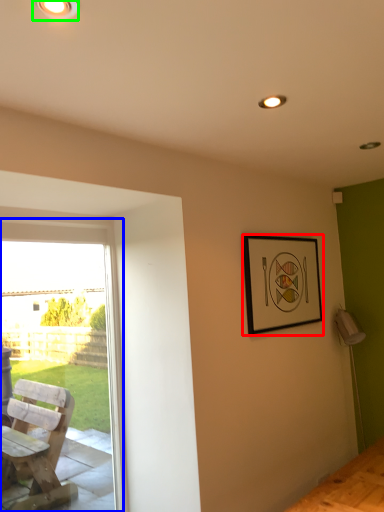
Question: Considering the real-world distances, which object is farthest from picture frame (highlighted by a red box)? window (highlighted by a blue box) or light fixture (highlighted by a green box)?

Choices:
 (A) window
 (B) light fixture

Answer: (B)